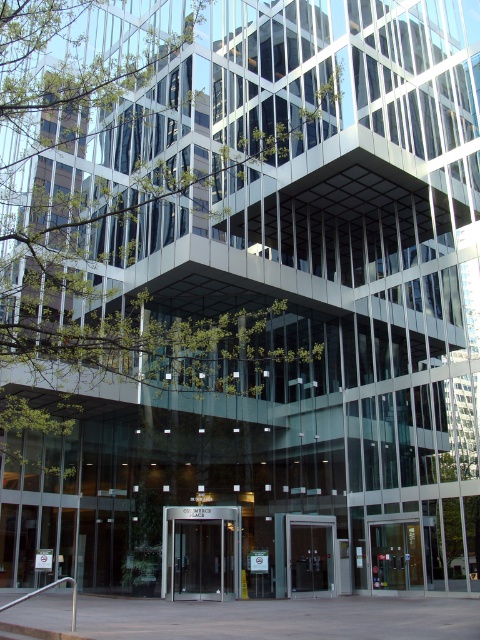
Between dark brown glass door at center and matte glass door at center, which one is positioned higher?

dark brown glass door at center

Who is positioned more to the left, dark brown glass door at center or matte glass door at center?

dark brown glass door at center

Who is more distant from viewer, (214, 577) or (333, 584)?

The point (333, 584) is more distant.

The width and height of the screenshot is (480, 640). What are the coordinates of `dark brown glass door at center` in the screenshot? It's located at (196, 557).